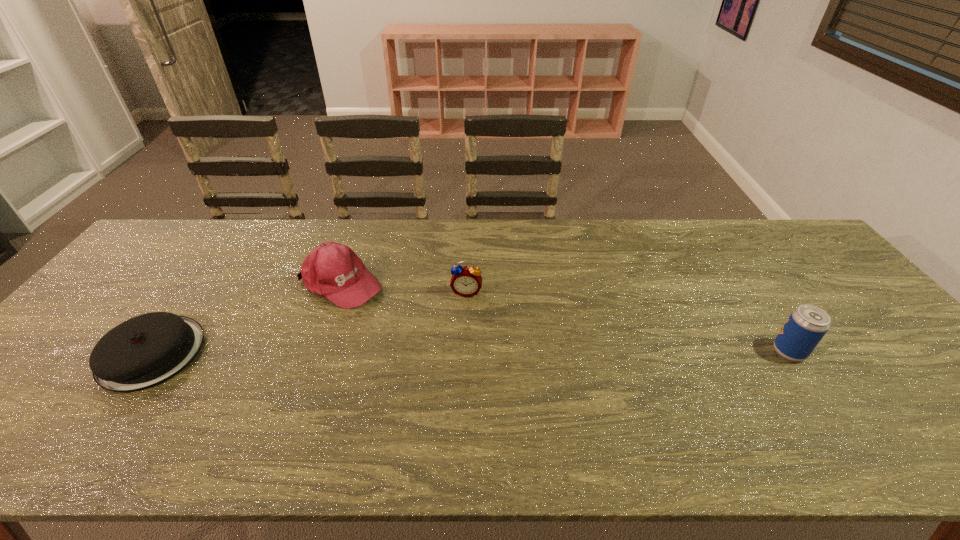
At what (x,y) coordinates should I click in order to perform the action: click on the shortest object. Please return your answer as a coordinate pair (x, y). Looking at the image, I should click on (144, 351).

Where is `the leftmost object`? This screenshot has height=540, width=960. the leftmost object is located at coordinates (144, 351).

You are a GUI agent. You are given a task and a screenshot of the screen. Output one action in this format:
    pyautogui.click(x=<x>, y=<y>)
    Task: Click on the rightmost object
    The width and height of the screenshot is (960, 540).
    Given the screenshot: What is the action you would take?
    pyautogui.click(x=807, y=324)

Where is `the third object from left to right`? The height and width of the screenshot is (540, 960). the third object from left to right is located at coordinates (466, 281).

The image size is (960, 540). I want to click on baseball cap, so click(x=332, y=270).

Find the location of a particular element. blank space located 0.180m on the right of the leftmost object is located at coordinates (272, 353).

In order to click on free space located 0.150m on the back of the rightmost object in this screenshot , I will do `click(754, 299)`.

The image size is (960, 540). I want to click on free space located on the front-facing side of the third object from left to right, so click(x=452, y=402).

Identify the location of vacant space located on the front-facing side of the third object from left to right. (459, 347).

Find the location of `free region located 0.160m on the front-facing side of the third object from left to right`. free region located 0.160m on the front-facing side of the third object from left to right is located at coordinates (460, 341).